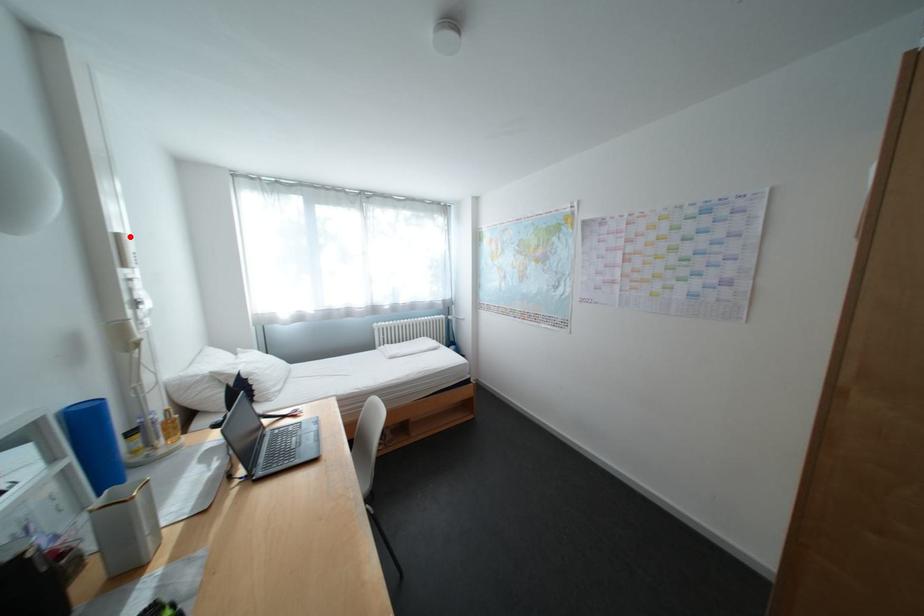
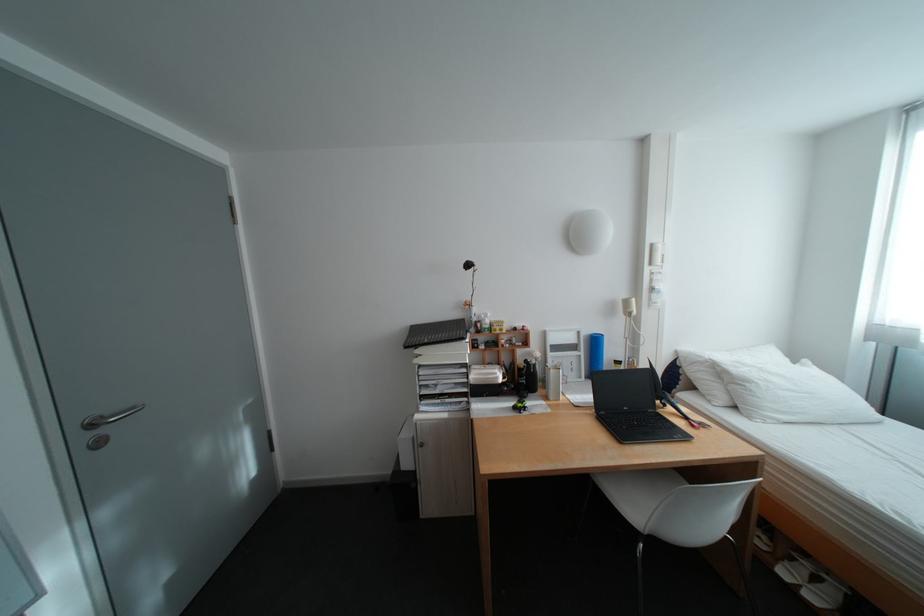
Find the pixel in the second image that matches the highlighted location in the first image.

(664, 246)